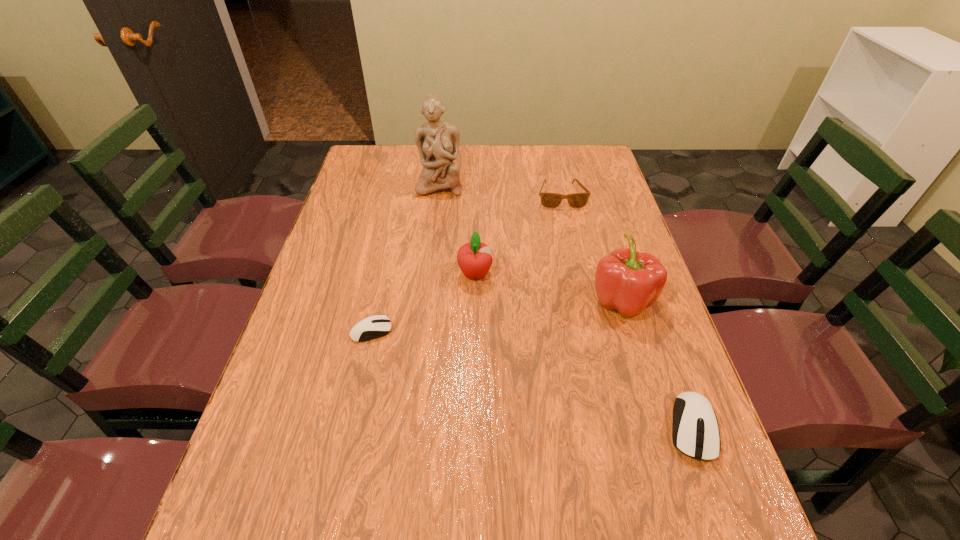
To make them evenly spaced by inserting another mouse_(computer_equipment) among them, please locate a vacant spot for this new mouse_(computer_equipment). Please provide its 2D coordinates. Your answer should be formatted as a tuple, i.e. [(x, y)], where the tuple contains the x and y coordinates of a point satisfying the conditions above.

[(517, 375)]